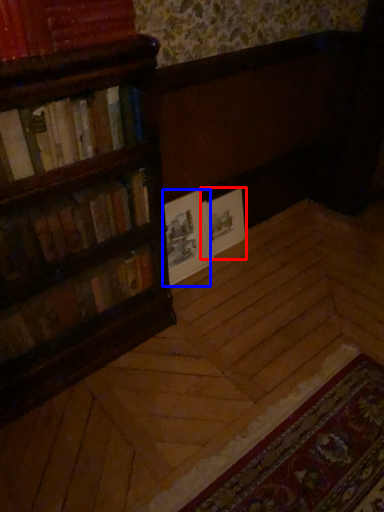
Question: Which point is closer to the camera, book cover (highlighted by a red box) or paperback book (highlighted by a blue box)?

Choices:
 (A) book cover
 (B) paperback book

Answer: (B)